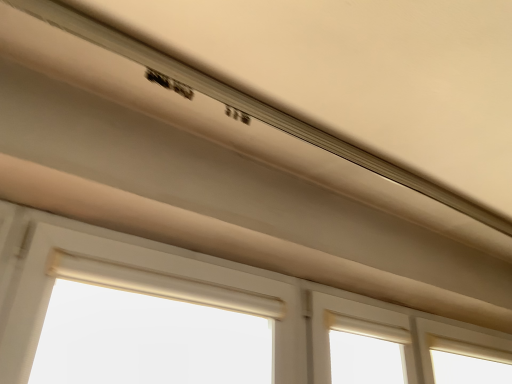
Question: From a real-world perspective, is white matte window at center located higher than matte white exhaust hood at upper center?

Choices:
 (A) no
 (B) yes

Answer: (A)

Question: Can you confirm if white matte window at center is taller than matte white exhaust hood at upper center?

Choices:
 (A) yes
 (B) no

Answer: (B)

Question: Is matte white exhaust hood at upper center inside white matte window at center?

Choices:
 (A) no
 (B) yes

Answer: (A)

Question: Is white matte window at center completely or partially outside of matte white exhaust hood at upper center?

Choices:
 (A) no
 (B) yes

Answer: (B)

Question: Are white matte window at center and matte white exhaust hood at upper center far apart?

Choices:
 (A) no
 (B) yes

Answer: (A)

Question: From the image's perspective, is beige fabric curtain at lower center above or below white matte window at center?

Choices:
 (A) above
 (B) below

Answer: (A)

Question: Is point (211, 312) positioned closer to the camera than point (287, 309)?

Choices:
 (A) closer
 (B) farther

Answer: (A)

Question: In the image, is beige fabric curtain at lower center on the left side or the right side of white matte window at center?

Choices:
 (A) left
 (B) right

Answer: (A)

Question: Do you think beige fabric curtain at lower center is within white matte window at center, or outside of it?

Choices:
 (A) outside
 (B) inside

Answer: (A)

Question: Is white matte window at center in front of or behind matte white exhaust hood at upper center in the image?

Choices:
 (A) behind
 (B) front

Answer: (A)

Question: In terms of height, does white matte window at center look taller or shorter compared to matte white exhaust hood at upper center?

Choices:
 (A) tall
 (B) short

Answer: (B)

Question: From a real-world perspective, is white matte window at center physically located above or below matte white exhaust hood at upper center?

Choices:
 (A) below
 (B) above

Answer: (A)

Question: Is white matte window at center inside the boundaries of matte white exhaust hood at upper center, or outside?

Choices:
 (A) inside
 (B) outside

Answer: (B)

Question: From the image's perspective, is matte white exhaust hood at upper center located above or below beige fabric curtain at lower center?

Choices:
 (A) above
 (B) below

Answer: (A)

Question: From a real-world perspective, relative to beige fabric curtain at lower center, is matte white exhaust hood at upper center vertically above or below?

Choices:
 (A) below
 (B) above

Answer: (B)